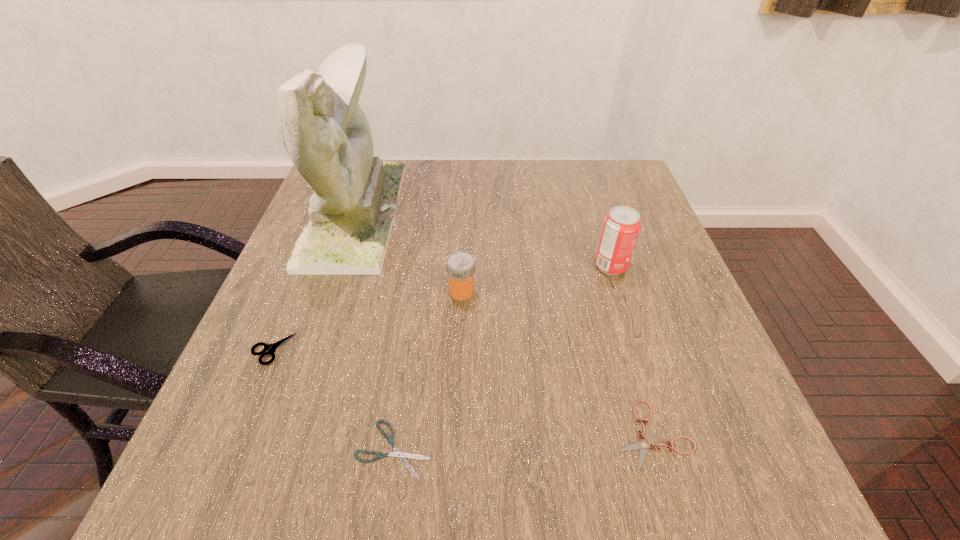
Where is `free location located on the label side of the fourth shortest object`? This screenshot has height=540, width=960. free location located on the label side of the fourth shortest object is located at coordinates (540, 292).

Identify the location of free space located on the back of the tallest shears. tap(303, 275).

Identify the location of vacant space located 0.260m on the left of the rightmost shears. The height and width of the screenshot is (540, 960). (450, 435).

Locate an element on the screen. The height and width of the screenshot is (540, 960). free space located 0.270m on the right of the second shears from left to right is located at coordinates (603, 448).

The image size is (960, 540). I want to click on object that is at the far edge, so click(326, 134).

The image size is (960, 540). In order to click on sculpture that is at the left edge in this screenshot , I will do `click(326, 134)`.

The height and width of the screenshot is (540, 960). I want to click on shears that is at the left edge, so click(x=270, y=348).

Locate an element on the screen. This screenshot has width=960, height=540. soda can situated at the right edge is located at coordinates coord(621,226).

Image resolution: width=960 pixels, height=540 pixels. I want to click on shears positioned at the right edge, so click(x=642, y=444).

Locate an element on the screen. This screenshot has height=540, width=960. object present at the far left corner is located at coordinates coord(326,134).